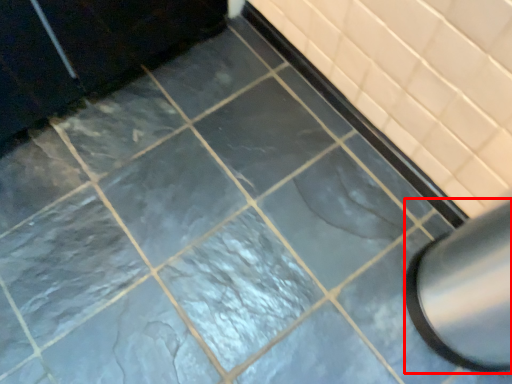
Question: From the image's perspective, where is exhaust hood (annotated by the red box) located in relation to bath in the image?

Choices:
 (A) below
 (B) above

Answer: (A)